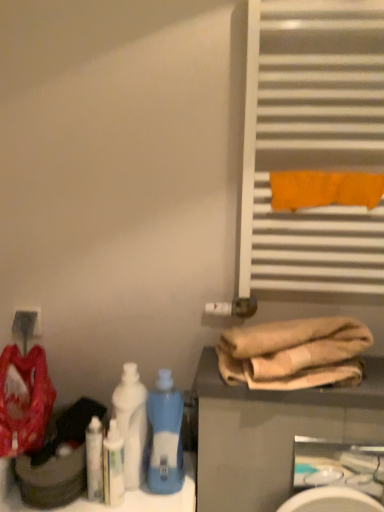
Question: Is matte white electric outlet at lower left to the right of beige cotton towels at lower right from the viewer's perspective?

Choices:
 (A) no
 (B) yes

Answer: (A)

Question: From a real-world perspective, is matte white electric outlet at lower left physically above beige cotton towels at lower right?

Choices:
 (A) no
 (B) yes

Answer: (A)

Question: Can we say matte white electric outlet at lower left lies outside beige cotton towels at lower right?

Choices:
 (A) yes
 (B) no

Answer: (A)

Question: Is matte white electric outlet at lower left touching beige cotton towels at lower right?

Choices:
 (A) no
 (B) yes

Answer: (A)

Question: Can you confirm if matte white electric outlet at lower left is bigger than beige cotton towels at lower right?

Choices:
 (A) no
 (B) yes

Answer: (A)

Question: Which is correct: white glossy bottle at lower left, which is the first cleaning product from left to right, is inside white glossy bottle at lower left, marked as the 2th cleaning product in a left-to-right arrangement, or outside of it?

Choices:
 (A) inside
 (B) outside

Answer: (B)

Question: Considering the positions of white glossy bottle at lower left, which is the first cleaning product from left to right, and white glossy bottle at lower left, which is the 1th cleaning product in right-to-left order, in the image, is white glossy bottle at lower left, which is the first cleaning product from left to right, taller or shorter than white glossy bottle at lower left, which is the 1th cleaning product in right-to-left order,?

Choices:
 (A) short
 (B) tall

Answer: (B)

Question: From a real-world perspective, relative to white glossy bottle at lower left, marked as the 2th cleaning product in a left-to-right arrangement, is white glossy bottle at lower left, the 2th cleaning product when ordered from right to left, vertically above or below?

Choices:
 (A) below
 (B) above

Answer: (B)

Question: In the image, is white glossy bottle at lower left, the 2th cleaning product when ordered from right to left, positioned in front of or behind white glossy bottle at lower left, which is the 1th cleaning product in right-to-left order?

Choices:
 (A) front
 (B) behind

Answer: (B)

Question: Based on their positions, is white glossy bottle at lower left, the 2th cleaning product when ordered from right to left, located to the left or right of matte red fabric at left?

Choices:
 (A) right
 (B) left

Answer: (A)

Question: Is white glossy bottle at lower left, which is the first cleaning product from left to right, spatially inside matte red fabric at left, or outside of it?

Choices:
 (A) inside
 (B) outside

Answer: (B)

Question: Based on their sizes in the image, would you say white glossy bottle at lower left, the 2th cleaning product when ordered from right to left, is bigger or smaller than matte red fabric at left?

Choices:
 (A) big
 (B) small

Answer: (B)

Question: In terms of width, does white glossy bottle at lower left, which is the first cleaning product from left to right, look wider or thinner when compared to matte red fabric at left?

Choices:
 (A) thin
 (B) wide

Answer: (A)

Question: Is white plastic bottle at center, the first bottle positioned from the left, taller or shorter than matte red fabric at left?

Choices:
 (A) short
 (B) tall

Answer: (B)

Question: Does point (139, 479) appear closer or farther from the camera than point (11, 423)?

Choices:
 (A) closer
 (B) farther

Answer: (B)